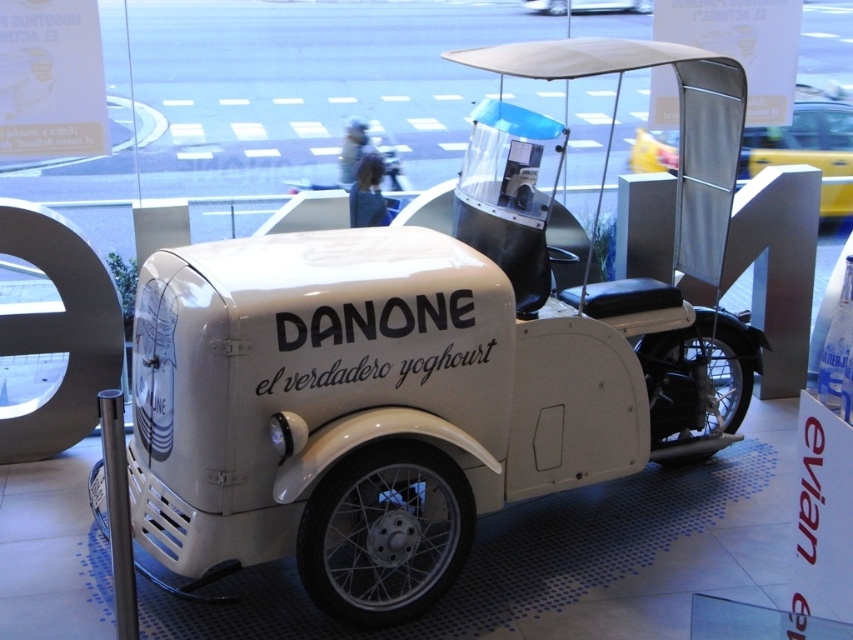
You are a museum curator planning to move the white matte cart at center and the white matte motorcycle at upper center into a storage room with a 1.5 meter wide entrance. Based on their sizes, which object might have difficulty fitting through the entrance?

The white matte cart at center has a larger width than the white matte motorcycle at upper center, so the white matte cart at center might have difficulty fitting through the 1.5 meter wide entrance.

You are standing in front of the vintage Danone milk delivery vehicle and want to touch the white matte motorcycle at center and the white matte motorcycle at upper center. Which one would you need to reach out further to touch?

You would need to reach out further to touch the white matte motorcycle at upper center because it is farther from you compared to the white matte motorcycle at center, which is closer.